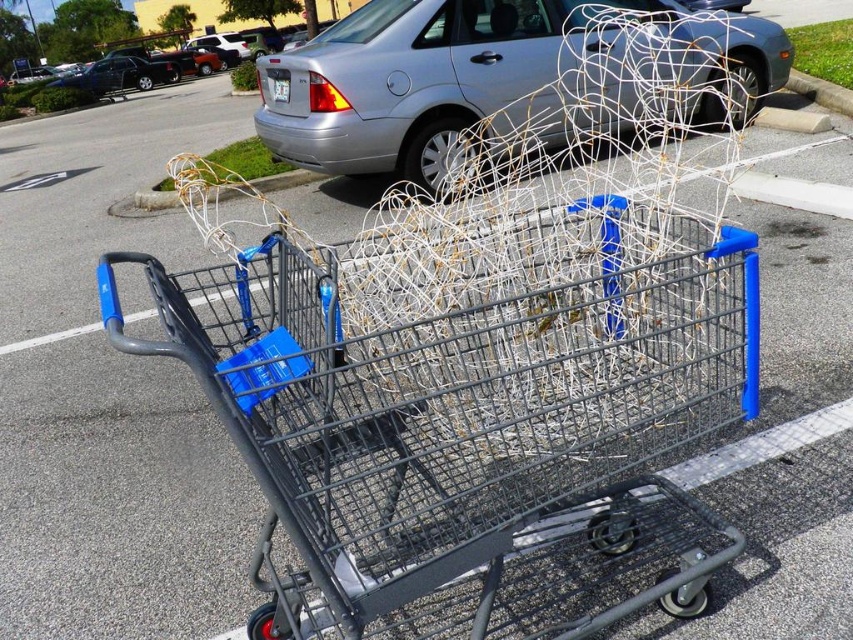
You are standing at the parking lot and see the shopping cart with wires. There are two points marked on the cart. One is at point (680,376) and the other at point (328,157). Which point is closer to you when you are facing the cart?

Point (680,376) is in front of point (328,157), so when facing the cart, point (680,376) is closer to you.

You are a delivery person trying to park your van behind the metallic gray shopping cart at center and the silver metallic sedan at center. Can you park your van behind both objects without blocking any other vehicles?

The metallic gray shopping cart at center is in front of the silver metallic sedan at center. Since the sedan is behind the cart, you can park behind the sedan, ensuring you don not block it or the cart.